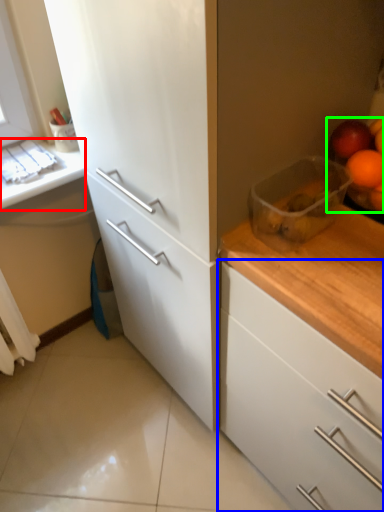
Question: Estimate the real-world distances between objects in this image. Which object is farther from counter top (highlighted by a red box), cabinetry (highlighted by a blue box) or fruit (highlighted by a green box)?

Choices:
 (A) cabinetry
 (B) fruit

Answer: (A)